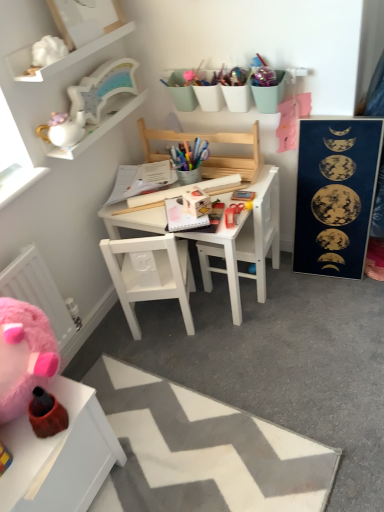
Where is `vacant area that lies between blue matte poster at right and white zigzag rug at lower center`? This screenshot has width=384, height=512. vacant area that lies between blue matte poster at right and white zigzag rug at lower center is located at coordinates (279, 352).